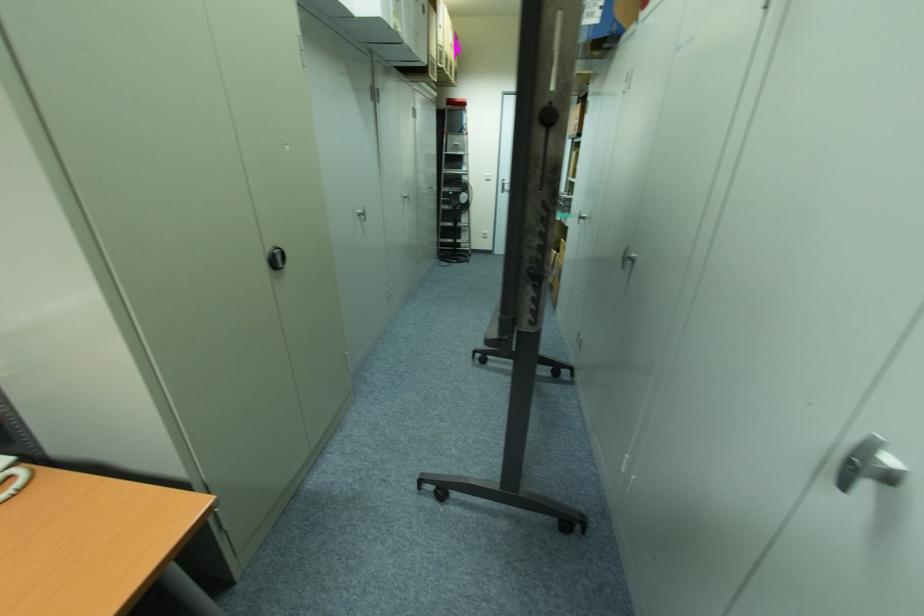
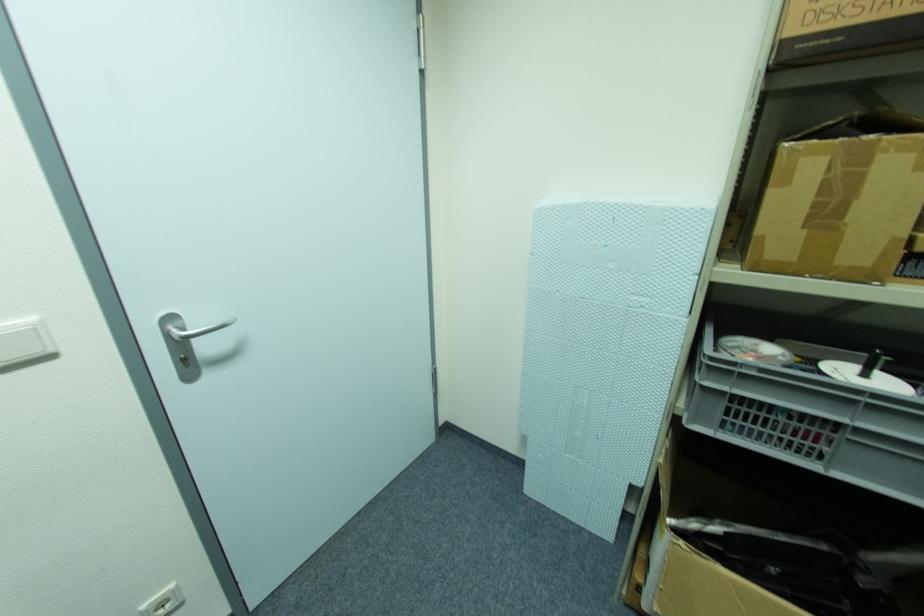
The point at (491, 177) is marked in the first image. Where is the corresponding point in the second image?

(34, 331)